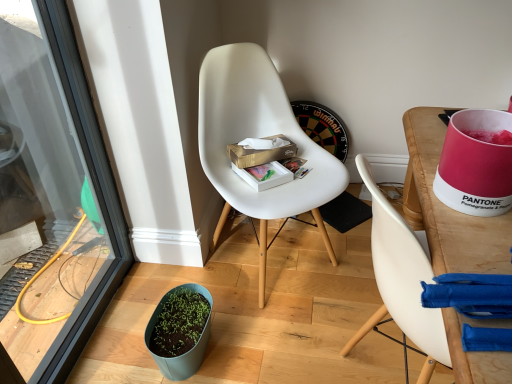
Question: From a real-world perspective, is wooden desk at right physically located above or below transparent glass screen door at lower left?

Choices:
 (A) above
 (B) below

Answer: (B)

Question: In the image, is wooden desk at right on the left side or the right side of transparent glass screen door at lower left?

Choices:
 (A) left
 (B) right

Answer: (B)

Question: Which object is positioned closest to the white matte box at center, which appears as the second box when viewed from the top?

Choices:
 (A) transparent glass screen door at lower left
 (B) white matte chair at center
 (C) gold cardboard tissue box at center, the first box viewed from the top
 (D) green matte flowerpot at lower left
 (E) wooden desk at right

Answer: (C)

Question: Which is nearer to the transparent glass screen door at lower left?

Choices:
 (A) wooden desk at right
 (B) white matte chair at center
 (C) green matte flowerpot at lower left
 (D) white matte box at center, placed as the 1th box when sorted from bottom to top
 (E) gold cardboard tissue box at center, the second box from the bottom

Answer: (C)